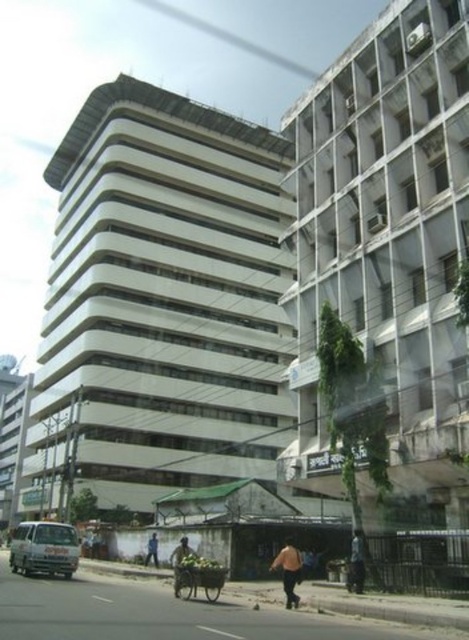
Is orange fabric bag at lower center wider than orange fabric bag at center?

Incorrect, orange fabric bag at lower center's width does not surpass orange fabric bag at center's.

Is orange fabric bag at lower center further to the viewer compared to orange fabric bag at center?

Yes.

Where is `orange fabric bag at lower center`? orange fabric bag at lower center is located at coordinates (355, 563).

Which is in front, point (31, 525) or point (174, 563)?

Point (174, 563) is in front.

Is white matte van at lower left above orange fabric bag at center?

Incorrect, white matte van at lower left is not positioned above orange fabric bag at center.

Is point (24, 536) farther from viewer compared to point (182, 547)?

Yes, point (24, 536) is behind point (182, 547).

Find the location of a particular element. white matte van at lower left is located at coordinates (44, 548).

Is brown fabric person at lower center bigger than dark orange shirt at center?

Yes.

Is point (285, 582) positioned after point (151, 556)?

No, it is not.

At what (x,y) coordinates should I click in order to perform the action: click on brown fabric person at lower center. Please return your answer as a coordinate pair (x, y). The height and width of the screenshot is (640, 469). Looking at the image, I should click on (288, 570).